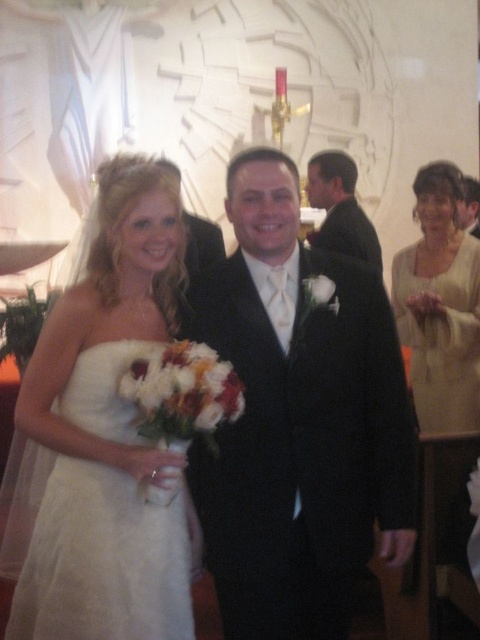
Question: In this image, where is matte cream blouse at right located relative to matte black suit at upper center?

Choices:
 (A) below
 (B) above

Answer: (A)

Question: Is black satin suit at center to the right of ivory satin dress at right from the viewer's perspective?

Choices:
 (A) no
 (B) yes

Answer: (A)

Question: Which point is farther to the camera?

Choices:
 (A) ivory satin dress at right
 (B) white satin dress at left
 (C) black satin suit at center

Answer: (A)

Question: Which object is the farthest from the matte black suit at center?

Choices:
 (A) matte cream blouse at right
 (B) ivory satin dress at right
 (C) white satin dress at left

Answer: (C)

Question: Is the position of matte cream blouse at right more distant than that of matte black suit at center?

Choices:
 (A) no
 (B) yes

Answer: (A)

Question: Which object appears farthest from the camera in this image?

Choices:
 (A) matte cream blouse at right
 (B) ivory satin dress at right

Answer: (A)